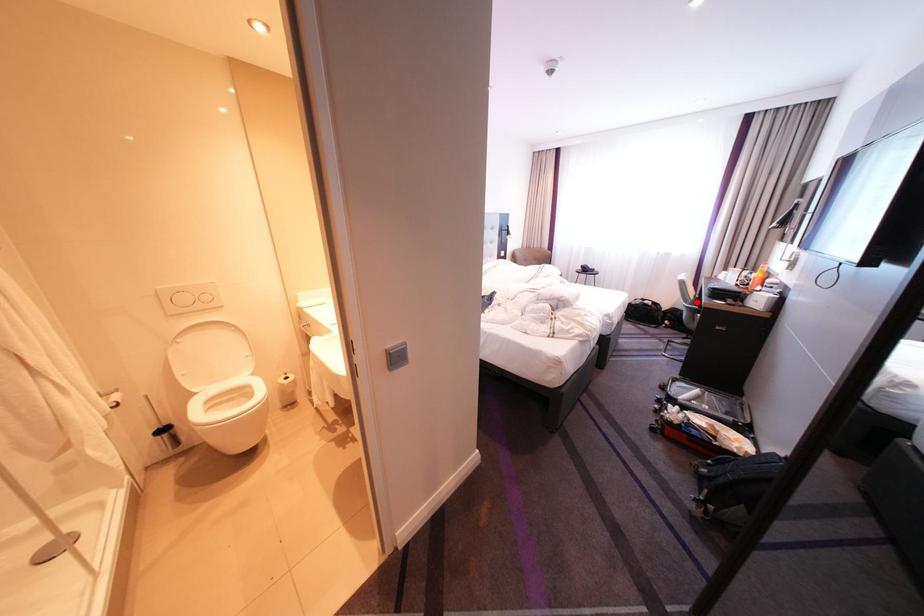
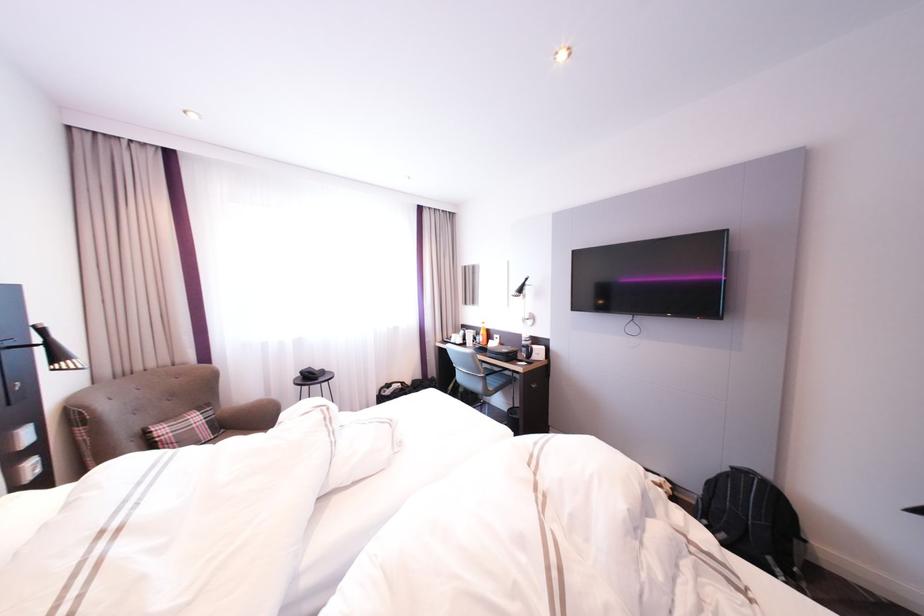
Question: I am providing you with two images of the same scene from different viewpoints. In image1, a red point is highlighted. Considering the same 3D point in image2, which of the following is correct?

Choices:
 (A) It is closer
 (B) It is farther

Answer: (B)